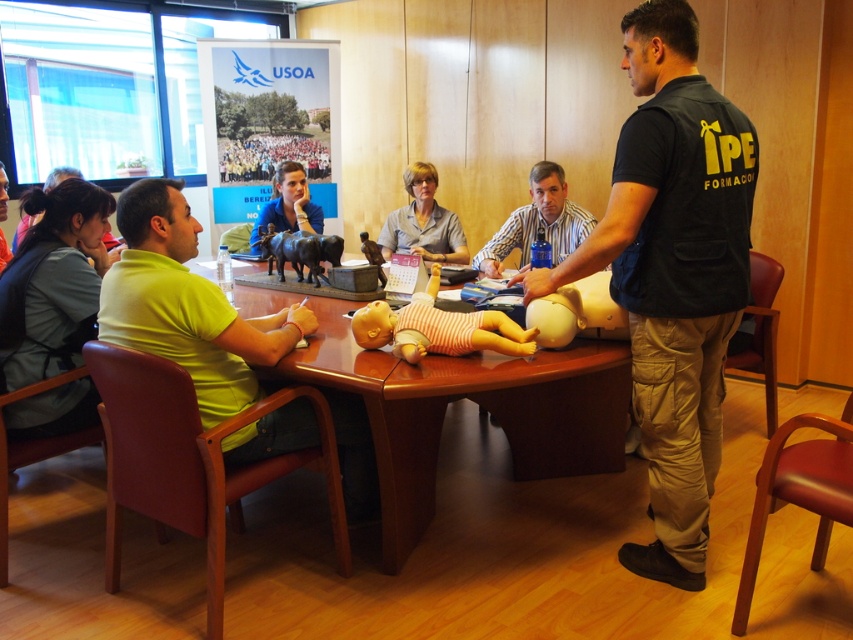
Does wooden table at center lie in front of light blue fabric shirt at center?

Answer: Yes, wooden table at center is closer to the viewer.

What do you see at coordinates (474, 401) in the screenshot?
I see `wooden table at center` at bounding box center [474, 401].

Between point (614, 435) and point (428, 250), which one is positioned in front?

Positioned in front is point (614, 435).

Where is `wooden table at center`? The height and width of the screenshot is (640, 853). wooden table at center is located at coordinates (474, 401).

Can you confirm if wooden table at center is bigger than matte blue shirt at center?

Indeed, wooden table at center has a larger size compared to matte blue shirt at center.

Between point (436, 417) and point (561, 193), which one is positioned in front?

Positioned in front is point (436, 417).

Where is `wooden table at center`? wooden table at center is located at coordinates (474, 401).

Which of these two, light blue fabric shirt at center or metallic brown cow at center, stands shorter?

metallic brown cow at center is shorter.

Which of these two, light blue fabric shirt at center or metallic brown cow at center, stands taller?

Standing taller between the two is light blue fabric shirt at center.

Between point (440, 228) and point (339, 262), which one is positioned in front?

Point (339, 262) is in front.

The width and height of the screenshot is (853, 640). I want to click on light blue fabric shirt at center, so click(422, 221).